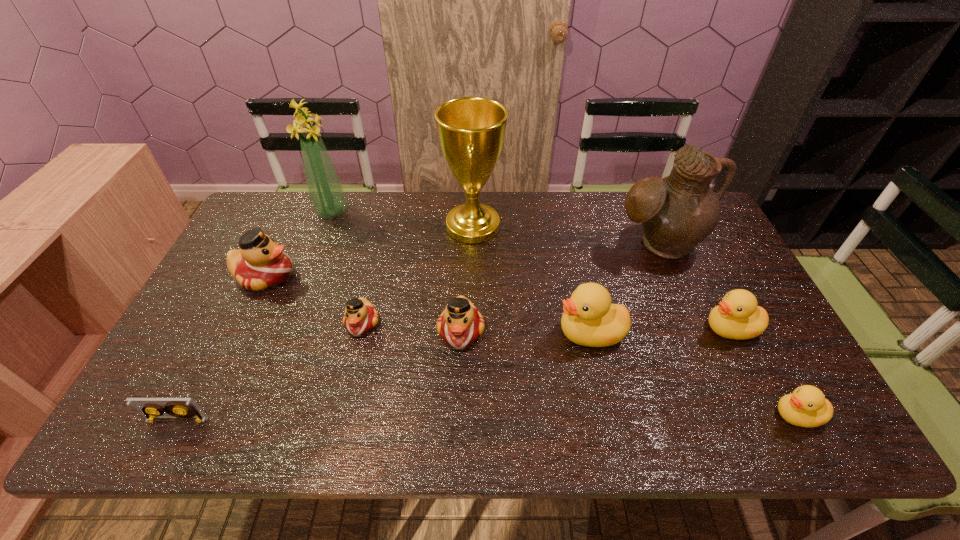
Find the location of `bouquet`. bouquet is located at coordinates (326, 194).

Where is `award`? The height and width of the screenshot is (540, 960). award is located at coordinates (471, 130).

Locate an element on the screen. This screenshot has width=960, height=540. pitcher is located at coordinates tap(677, 212).

The height and width of the screenshot is (540, 960). Identify the location of the eighth shortest object. (677, 212).

Locate an element on the screen. The height and width of the screenshot is (540, 960). the leftmost red duck is located at coordinates (260, 264).

You are a GUI agent. You are given a task and a screenshot of the screen. Output one action in this format:
    pyautogui.click(x=<x>, y=<y>)
    Task: Click on the farthest duck
    
    Given the screenshot: What is the action you would take?
    pyautogui.click(x=260, y=264)

Image resolution: width=960 pixels, height=540 pixels. Identify the location of the leftmost yellow duck. (589, 319).

The image size is (960, 540). In order to click on the biggest yellow duck in this screenshot , I will do pos(589,319).

Locate an element on the screen. The height and width of the screenshot is (540, 960). the second biggest red duck is located at coordinates (460, 324).

Find the location of `the third duck from left to right`. the third duck from left to right is located at coordinates (460, 324).